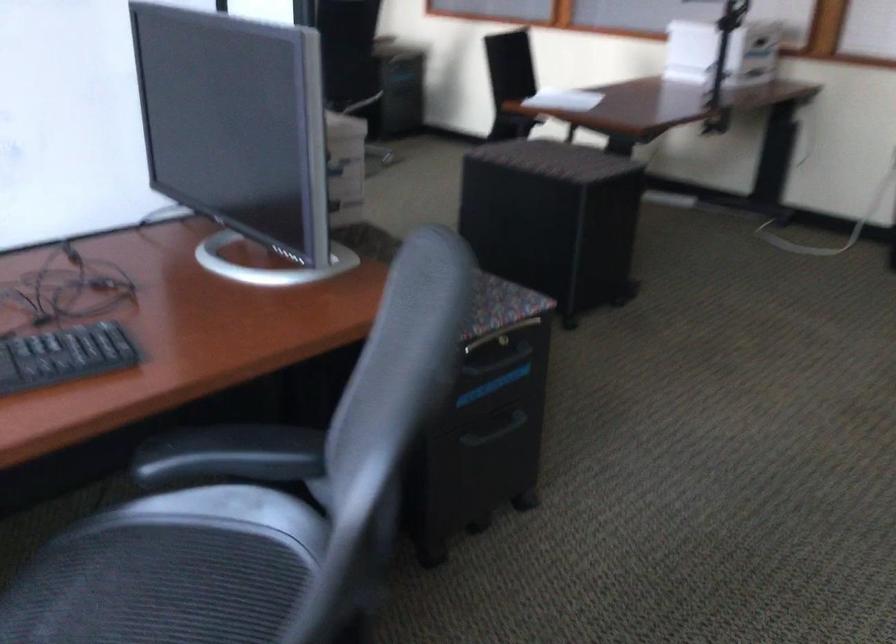
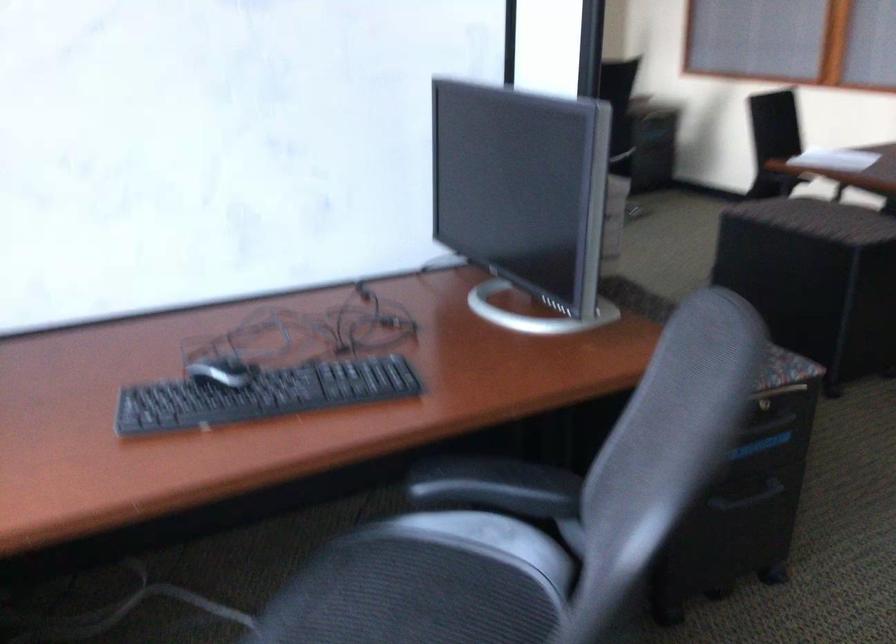
Find the pixel in the second image that matches [229,453] in the first image.

(495, 486)